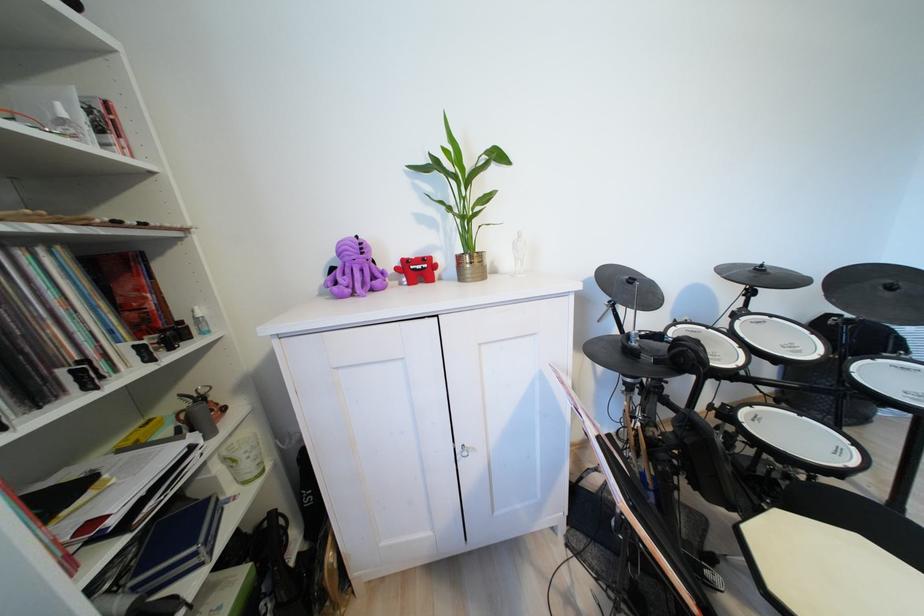
In order to click on metal cabinet handle in this screenshot , I will do `click(465, 450)`.